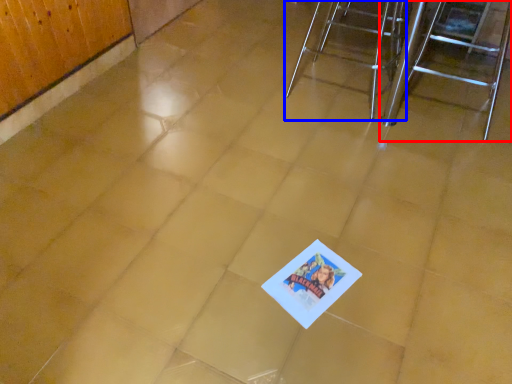
Question: Which point is further to the camera, furniture (highlighted by a red box) or furniture (highlighted by a blue box)?

Choices:
 (A) furniture
 (B) furniture

Answer: (B)